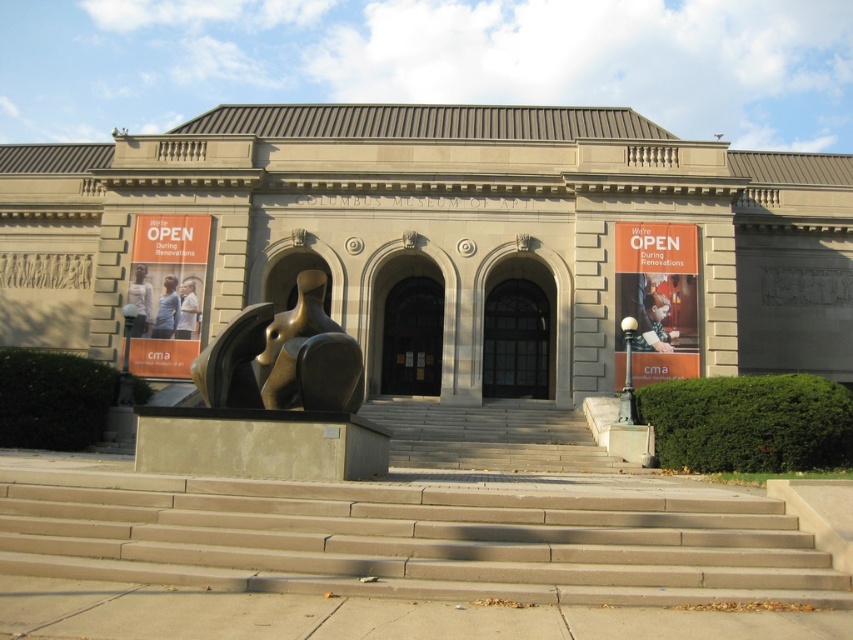
From the picture: You are a photographer standing in front of the Columbus Museum of Art. You want to take a photo that includes both the light blue shirt at center and the light brown leather jacket at lower left. What is the minimum distance you need to move backward to ensure both objects are in frame?

The light blue shirt at center and light brown leather jacket at lower left are 36.27 inches apart. To include both in the frame, you need to move backward until your camera can capture a field of view that accommodates this distance. The exact distance depends on your camera lens, but generally, increasing the distance from the subjects widens the field of view, allowing both objects to be captured.

You are an artist visiting the Columbus Museum of Art. You see the bronze sculpture at center and the light brown leather jacket at center in front of the museum. Which object is larger?

The bronze sculpture at center is bigger than the light brown leather jacket at center.